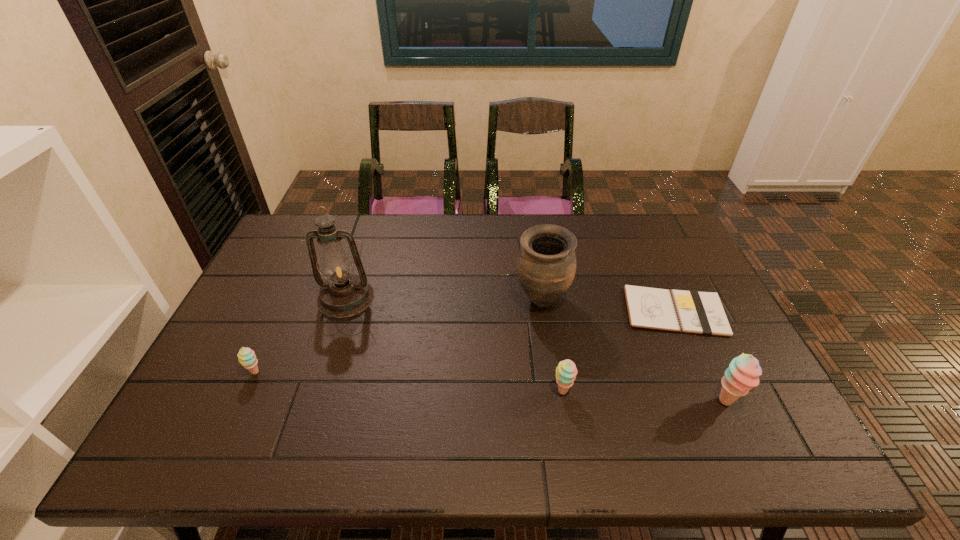
The width and height of the screenshot is (960, 540). In order to click on the leftmost object in this screenshot , I will do `click(246, 356)`.

Where is `the leftmost sherbert`? This screenshot has height=540, width=960. the leftmost sherbert is located at coordinates (246, 356).

This screenshot has height=540, width=960. I want to click on the second tallest sherbert, so (566, 371).

The height and width of the screenshot is (540, 960). I want to click on the third shortest object, so click(566, 371).

The height and width of the screenshot is (540, 960). Find the location of `the fourth shortest object`. the fourth shortest object is located at coordinates (743, 373).

Find the location of a particular element. The image size is (960, 540). the tallest sherbert is located at coordinates pyautogui.click(x=743, y=373).

This screenshot has width=960, height=540. In order to click on urn in this screenshot , I will do `click(546, 263)`.

Locate an element on the screen. The width and height of the screenshot is (960, 540). the fifth object from right to left is located at coordinates (344, 294).

I want to click on oil lamp, so click(x=344, y=294).

I want to click on the shortest object, so click(x=698, y=312).